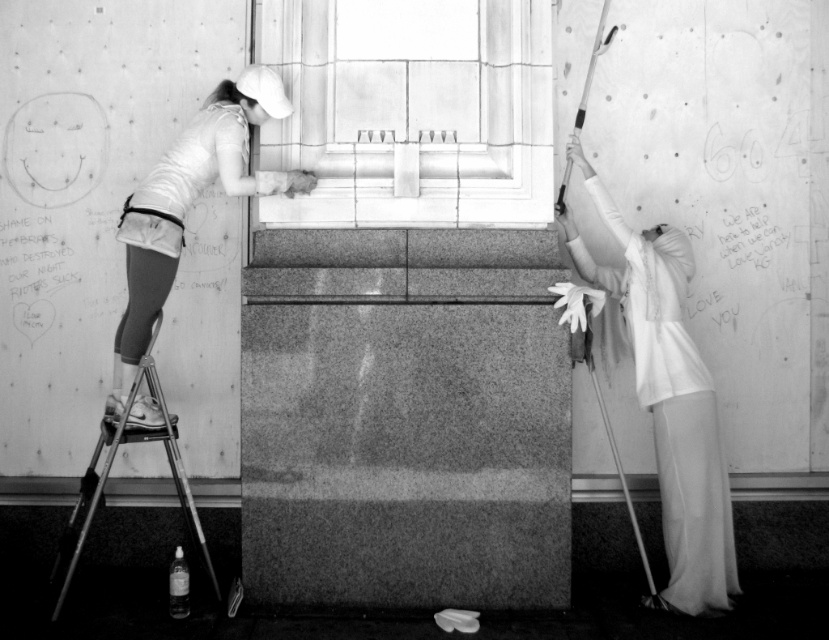
Question: Can you confirm if smooth stone window at center is positioned below matte white shirt at upper left?

Choices:
 (A) no
 (B) yes

Answer: (A)

Question: Which is nearer to the metallic silver ladder at lower left?

Choices:
 (A) white cotton shirt at right
 (B) matte white shirt at upper left
 (C) smooth stone window at center

Answer: (B)

Question: Which object appears farthest from the camera in this image?

Choices:
 (A) metallic silver ladder at lower left
 (B) smooth stone window at center

Answer: (B)

Question: Can you confirm if smooth stone window at center is positioned above white cotton shirt at right?

Choices:
 (A) yes
 (B) no

Answer: (A)

Question: Which point is closer to the camera taking this photo?

Choices:
 (A) (628, 273)
 (B) (137, 225)
 (C) (483, 179)
 (D) (160, 432)

Answer: (D)

Question: Can you confirm if matte white shirt at upper left is positioned below metallic silver ladder at lower left?

Choices:
 (A) yes
 (B) no

Answer: (B)